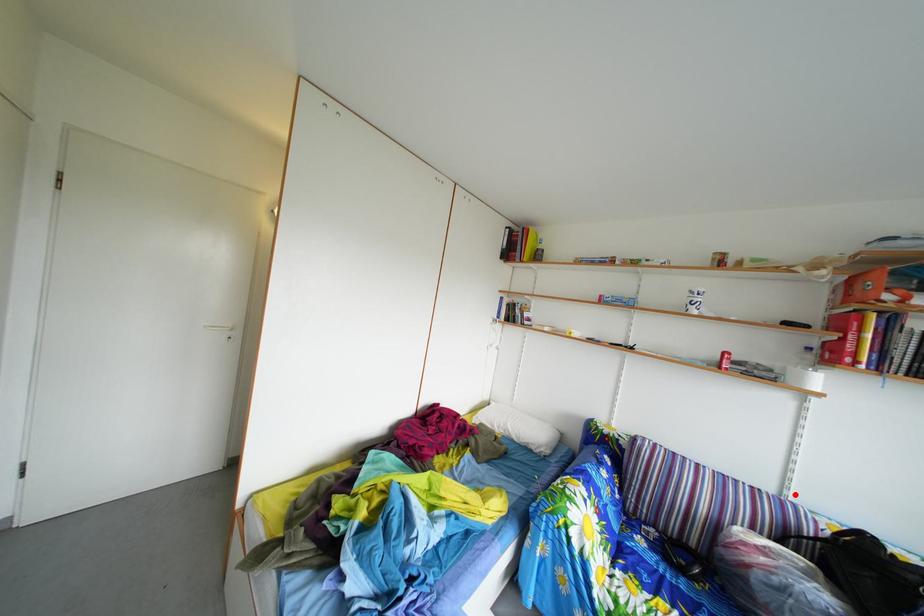
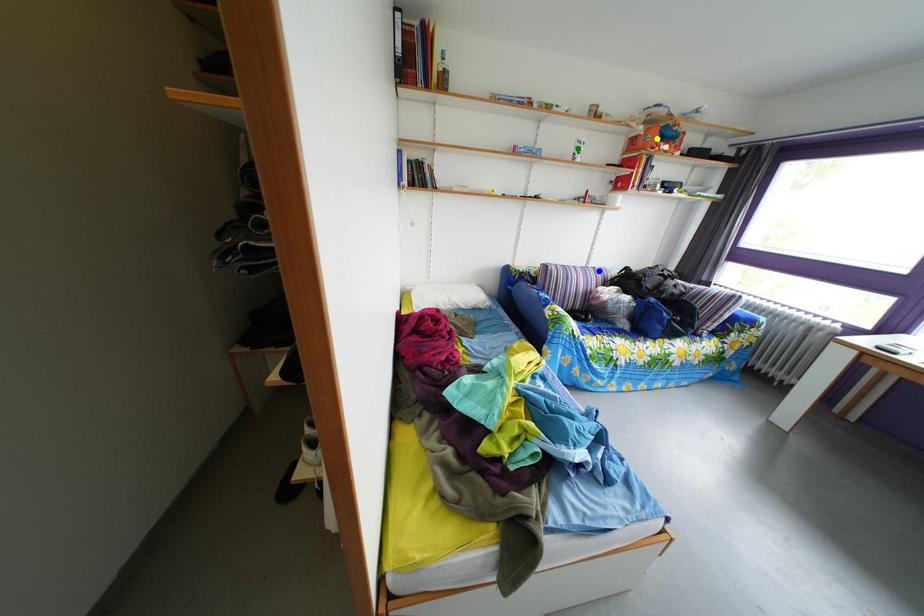
Question: I am providing you with two images of the same scene from different viewpoints. A red point is marked on the first image. You are given multiple points on the second image. Which point in image 2 is actually the same real-world point as the red point in image 1?

Choices:
 (A) blue point
 (B) green point
 (C) yellow point

Answer: (A)